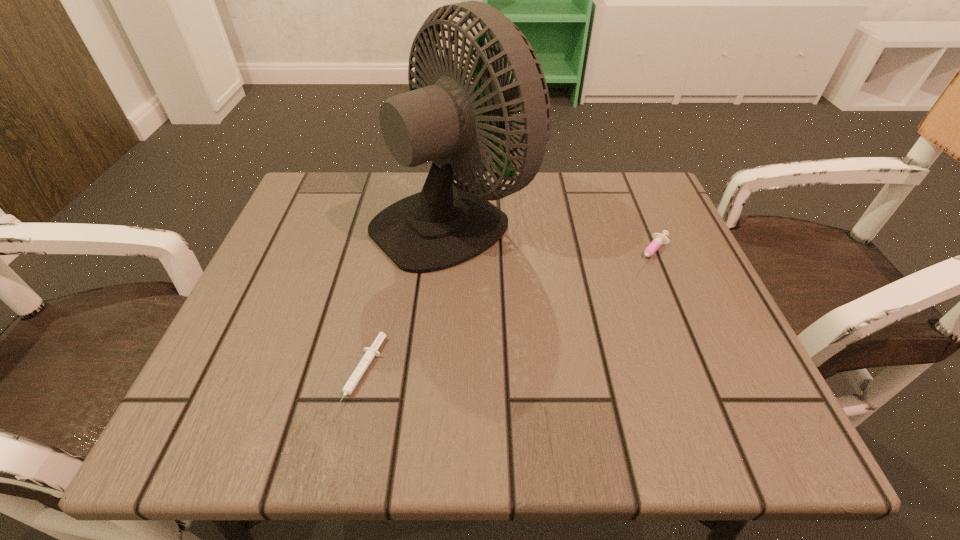
Locate an element on the screen. The image size is (960, 540). vacant area between the farther syringe and the nearer syringe is located at coordinates (506, 314).

Locate an element on the screen. free space that is in between the shortest object and the farther syringe is located at coordinates (506, 314).

Find the location of a particular element. This screenshot has width=960, height=540. vacant area that lies between the farther syringe and the tallest object is located at coordinates (552, 235).

The height and width of the screenshot is (540, 960). Find the location of `unoccupied area between the tallest object and the rightmost object`. unoccupied area between the tallest object and the rightmost object is located at coordinates (552, 235).

Locate an element on the screen. This screenshot has width=960, height=540. vacant space that is in between the right syringe and the fan is located at coordinates (552, 235).

You are a GUI agent. You are given a task and a screenshot of the screen. Output one action in this format:
    pyautogui.click(x=<x>, y=<y>)
    Task: Click on the free space that is in between the shortest object and the rightmost object
    
    Given the screenshot: What is the action you would take?
    pyautogui.click(x=506, y=314)

Find the location of a particular element. The image size is (960, 540). empty space between the right syringe and the tallest object is located at coordinates (552, 235).

Find the location of a particular element. The height and width of the screenshot is (540, 960). free area in between the taller syringe and the shortest object is located at coordinates (506, 314).

Find the location of a particular element. object that stands as the closest to the nearer syringe is located at coordinates (447, 223).

Identify the location of object that is the second closest to the tallest object. This screenshot has width=960, height=540. (658, 239).